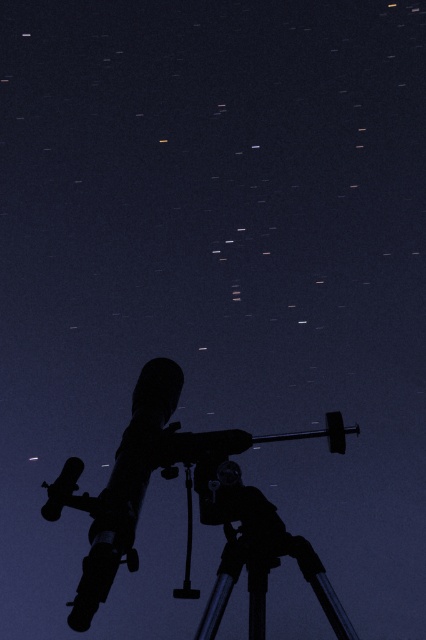
Question: Where is silhouette figure at center located in relation to metallic silver tripod at lower center in the image?

Choices:
 (A) right
 (B) left

Answer: (B)

Question: Which object is farther from the camera taking this photo?

Choices:
 (A) silhouette figure at center
 (B) metallic silver tripod at lower center
 (C) metallic telescope at center

Answer: (C)

Question: From the image, what is the correct spatial relationship of silhouette figure at center in relation to metallic silver tripod at lower center?

Choices:
 (A) right
 (B) left

Answer: (B)

Question: Which object appears closest to the camera in this image?

Choices:
 (A) metallic telescope at center
 (B) silhouette figure at center

Answer: (B)

Question: Which point is closer to the camera taking this photo?

Choices:
 (A) (129, 554)
 (B) (81, 464)

Answer: (A)

Question: Can you confirm if metallic telescope at center is positioned to the right of metallic silver tripod at lower center?

Choices:
 (A) no
 (B) yes

Answer: (A)